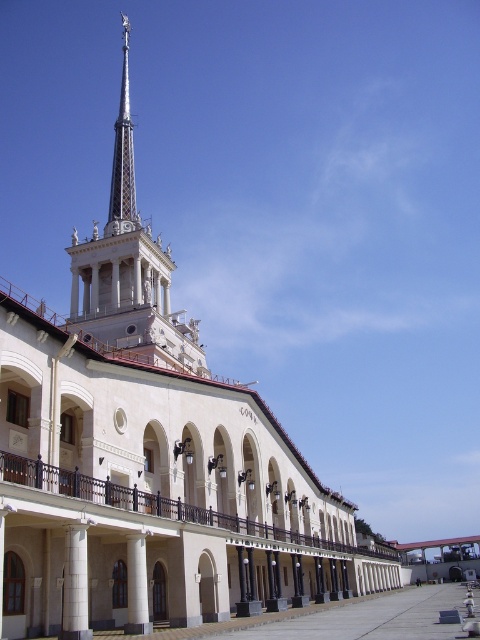
You are standing in front of the grand neoclassical building and notice the white stone column at lower left and the white smooth pillar at center. Which object blocks your view of the other?

The white stone column at lower left is in front of the white smooth pillar at center, so it blocks the view of the white smooth pillar at center.

You are an architect inspecting the building facade. You need to determine which structural element, the white stone column at lower left or the white smooth pillar at center, can support more weight based on their sizes. Which one would you choose?

The white stone column at lower left is larger in size than the white smooth pillar at center, so it can support more weight.

You are standing at the entrance of the grand neoclassical building and want to take a photo of the white stone column at lower left. To ensure the column is centered in your photo, where should you position your camera horizontally and vertically? Use the coordinates provided in the description to answer.

The white stone column at lower left is located at coordinates 0.914 horizontally and 0.156 vertically. To center it in your photo, position your camera at those coordinates.